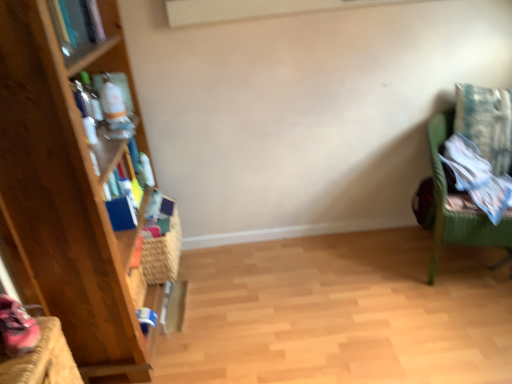
Question: From the image's perspective, does matte blue book at upper left appear lower than green wicker chair at right?

Choices:
 (A) no
 (B) yes

Answer: (A)

Question: Is the position of matte blue book at upper left less distant than that of green wicker chair at right?

Choices:
 (A) no
 (B) yes

Answer: (B)

Question: Does matte blue book at upper left turn towards green wicker chair at right?

Choices:
 (A) no
 (B) yes

Answer: (A)

Question: Is matte blue book at upper left touching green wicker chair at right?

Choices:
 (A) no
 (B) yes

Answer: (A)

Question: Is matte blue book at upper left further to the viewer compared to green wicker chair at right?

Choices:
 (A) no
 (B) yes

Answer: (A)

Question: Is matte blue book at upper left shorter than green wicker chair at right?

Choices:
 (A) yes
 (B) no

Answer: (A)

Question: Is green wicker chair at right next to woven straw basket at left?

Choices:
 (A) no
 (B) yes

Answer: (A)

Question: From a real-world perspective, is green wicker chair at right physically above woven straw basket at left?

Choices:
 (A) yes
 (B) no

Answer: (A)

Question: Does green wicker chair at right have a greater height compared to woven straw basket at left?

Choices:
 (A) yes
 (B) no

Answer: (A)

Question: Is green wicker chair at right thinner than woven straw basket at left?

Choices:
 (A) yes
 (B) no

Answer: (B)

Question: Is the position of green wicker chair at right less distant than that of woven straw basket at left?

Choices:
 (A) yes
 (B) no

Answer: (A)

Question: From the image's perspective, would you say green wicker chair at right is shown under woven straw basket at left?

Choices:
 (A) yes
 (B) no

Answer: (B)

Question: Considering the relative positions of woven straw basket at left and green wicker chair at right in the image provided, is woven straw basket at left in front of green wicker chair at right?

Choices:
 (A) yes
 (B) no

Answer: (B)